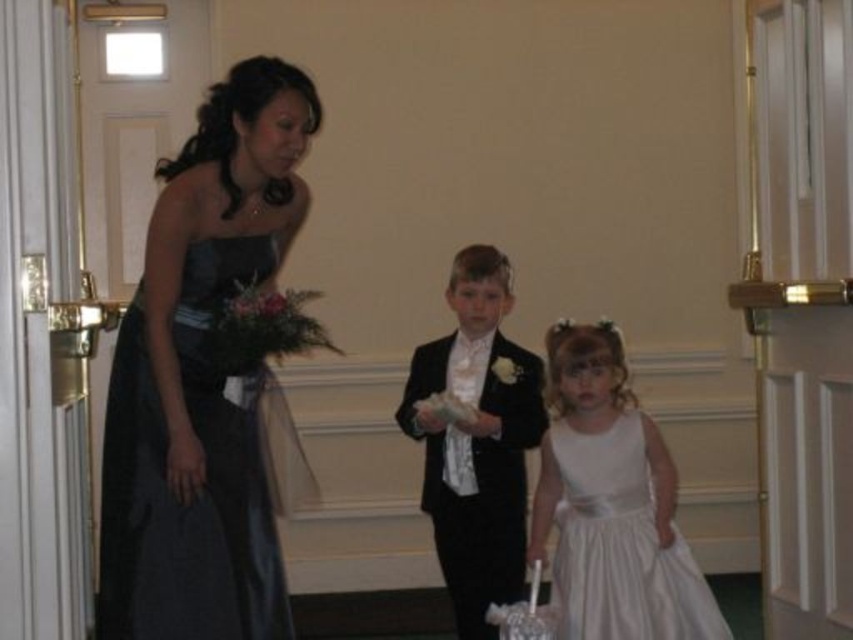
Question: Does shiny dark blue dress at left appear on the left side of white satin dress at center?

Choices:
 (A) no
 (B) yes

Answer: (B)

Question: Observing the image, what is the correct spatial positioning of white satin dress at center in reference to black satin suit at center?

Choices:
 (A) left
 (B) right

Answer: (B)

Question: Considering the real-world distances, which object is closest to the black satin suit at center?

Choices:
 (A) white satin dress at center
 (B) shiny dark blue dress at left

Answer: (A)

Question: Which object is farther from the camera taking this photo?

Choices:
 (A) black satin suit at center
 (B) white satin dress at center

Answer: (A)

Question: Does white satin dress at center appear on the right side of black satin suit at center?

Choices:
 (A) yes
 (B) no

Answer: (A)

Question: Which of the following is the closest to the observer?

Choices:
 (A) black satin suit at center
 (B) shiny dark blue dress at left
 (C) white satin dress at center

Answer: (B)